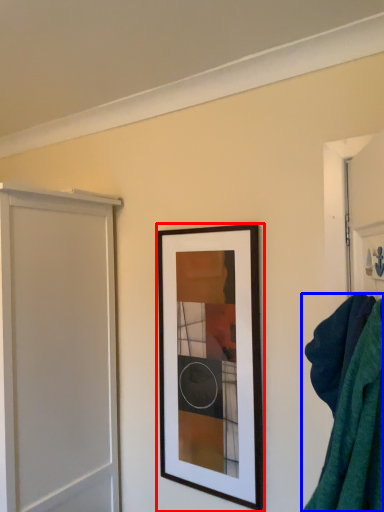
Question: Which point is further to the camera, picture frame (highlighted by a red box) or bath towel (highlighted by a blue box)?

Choices:
 (A) picture frame
 (B) bath towel

Answer: (A)